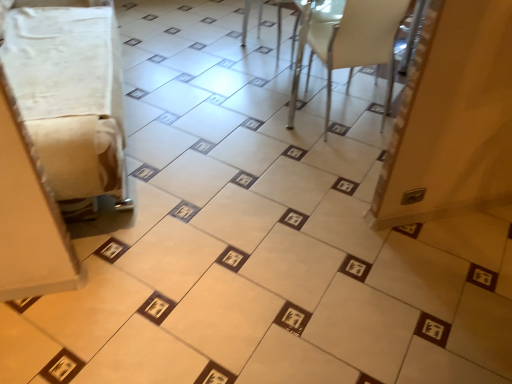
The height and width of the screenshot is (384, 512). What are the coordinates of `white fabric at left, which is the first furniture from left to right` in the screenshot? It's located at (69, 95).

This screenshot has width=512, height=384. Describe the element at coordinates (69, 95) in the screenshot. I see `white fabric at left, which is the first furniture from left to right` at that location.

Measure the distance between white fabric at left, acting as the second furniture starting from the right, and camera.

white fabric at left, acting as the second furniture starting from the right, is 4.86 feet away from camera.

What do you see at coordinates (348, 43) in the screenshot? I see `white plastic chair at upper right, which ranks as the 2th furniture in left-to-right order` at bounding box center [348, 43].

This screenshot has height=384, width=512. I want to click on white plastic chair at upper right, which ranks as the 2th furniture in left-to-right order, so click(348, 43).

Locate an element on the screen. white fabric at left, which is the first furniture from left to right is located at coordinates (69, 95).

Between white fabric at left, acting as the second furniture starting from the right, and white plastic chair at upper right, which ranks as the 2th furniture in left-to-right order, which one appears on the left side from the viewer's perspective?

white fabric at left, acting as the second furniture starting from the right, is more to the left.

Is white fabric at left, acting as the second furniture starting from the right, closer to camera compared to white plastic chair at upper right, which is counted as the 1th furniture, starting from the right?

Yes, it is in front of white plastic chair at upper right, which is counted as the 1th furniture, starting from the right.

Which is further, (54, 62) or (338, 39)?

Positioned behind is point (54, 62).

From the image's perspective, which is above, white fabric at left, which is the first furniture from left to right, or white plastic chair at upper right, which ranks as the 2th furniture in left-to-right order?

white plastic chair at upper right, which ranks as the 2th furniture in left-to-right order, is shown above in the image.

From a real-world perspective, which object stands above the other?

In real-world perspective, white fabric at left, which is the first furniture from left to right, is above.

Considering the sizes of objects white fabric at left, acting as the second furniture starting from the right, and white plastic chair at upper right, which ranks as the 2th furniture in left-to-right order, in the image provided, who is thinner, white fabric at left, acting as the second furniture starting from the right, or white plastic chair at upper right, which ranks as the 2th furniture in left-to-right order,?

Thinner between the two is white plastic chair at upper right, which ranks as the 2th furniture in left-to-right order.

Can you confirm if white fabric at left, which is the first furniture from left to right, is taller than white plastic chair at upper right, which ranks as the 2th furniture in left-to-right order?

No, white fabric at left, which is the first furniture from left to right, is not taller than white plastic chair at upper right, which ranks as the 2th furniture in left-to-right order.

Can you confirm if white fabric at left, acting as the second furniture starting from the right, is smaller than white plastic chair at upper right, which is counted as the 1th furniture, starting from the right?

No.

Would you say white fabric at left, which is the first furniture from left to right, is inside or outside white plastic chair at upper right, which ranks as the 2th furniture in left-to-right order?

white fabric at left, which is the first furniture from left to right, cannot be found inside white plastic chair at upper right, which ranks as the 2th furniture in left-to-right order.

Is white fabric at left, which is the first furniture from left to right, placed right next to white plastic chair at upper right, which ranks as the 2th furniture in left-to-right order?

No, white fabric at left, which is the first furniture from left to right, is not next to white plastic chair at upper right, which ranks as the 2th furniture in left-to-right order.

Is white fabric at left, acting as the second furniture starting from the right, positioned with its back to white plastic chair at upper right, which ranks as the 2th furniture in left-to-right order?

No, white fabric at left, acting as the second furniture starting from the right,'s orientation is not away from white plastic chair at upper right, which ranks as the 2th furniture in left-to-right order.

Measure the distance from white fabric at left, which is the first furniture from left to right, to white plastic chair at upper right, which is counted as the 1th furniture, starting from the right.

white fabric at left, which is the first furniture from left to right, is 1.23 meters away from white plastic chair at upper right, which is counted as the 1th furniture, starting from the right.

The width and height of the screenshot is (512, 384). What are the coordinates of `furniture positioned vertically above the white plastic chair at upper right, which is counted as the 1th furniture, starting from the right (from a real-world perspective)` in the screenshot? It's located at (69, 95).

Considering the relative positions of white plastic chair at upper right, which is counted as the 1th furniture, starting from the right, and white fabric at left, acting as the second furniture starting from the right, in the image provided, is white plastic chair at upper right, which is counted as the 1th furniture, starting from the right, to the right of white fabric at left, acting as the second furniture starting from the right, from the viewer's perspective?

Yes.

Which object is further away from the camera taking this photo, white plastic chair at upper right, which ranks as the 2th furniture in left-to-right order, or white fabric at left, which is the first furniture from left to right?

white plastic chair at upper right, which ranks as the 2th furniture in left-to-right order.

Which point is more distant from viewer, [316,38] or [82,89]?

The point [316,38] is farther from the camera.

From the image's perspective, is white plastic chair at upper right, which ranks as the 2th furniture in left-to-right order, located above or below white fabric at left, acting as the second furniture starting from the right?

Based on their image positions, white plastic chair at upper right, which ranks as the 2th furniture in left-to-right order, is located above white fabric at left, acting as the second furniture starting from the right.

From a real-world perspective, does white plastic chair at upper right, which ranks as the 2th furniture in left-to-right order, stand above white fabric at left, which is the first furniture from left to right?

Actually, white plastic chair at upper right, which ranks as the 2th furniture in left-to-right order, is physically below white fabric at left, which is the first furniture from left to right, in the real world.

Considering the relative sizes of white plastic chair at upper right, which is counted as the 1th furniture, starting from the right, and white fabric at left, which is the first furniture from left to right, in the image provided, is white plastic chair at upper right, which is counted as the 1th furniture, starting from the right, wider than white fabric at left, which is the first furniture from left to right,?

Incorrect, the width of white plastic chair at upper right, which is counted as the 1th furniture, starting from the right, does not surpass that of white fabric at left, which is the first furniture from left to right.

Between white plastic chair at upper right, which is counted as the 1th furniture, starting from the right, and white fabric at left, acting as the second furniture starting from the right, which one has less height?

Standing shorter between the two is white fabric at left, acting as the second furniture starting from the right.

Considering the relative sizes of white plastic chair at upper right, which is counted as the 1th furniture, starting from the right, and white fabric at left, which is the first furniture from left to right, in the image provided, is white plastic chair at upper right, which is counted as the 1th furniture, starting from the right, bigger than white fabric at left, which is the first furniture from left to right,?

Actually, white plastic chair at upper right, which is counted as the 1th furniture, starting from the right, might be smaller than white fabric at left, which is the first furniture from left to right.

Could white fabric at left, which is the first furniture from left to right, be considered to be inside white plastic chair at upper right, which is counted as the 1th furniture, starting from the right?

No, white fabric at left, which is the first furniture from left to right, is not inside white plastic chair at upper right, which is counted as the 1th furniture, starting from the right.

Is white plastic chair at upper right, which ranks as the 2th furniture in left-to-right order, far from white fabric at left, which is the first furniture from left to right?

Absolutely, white plastic chair at upper right, which ranks as the 2th furniture in left-to-right order, is distant from white fabric at left, which is the first furniture from left to right.

Could you tell me if white plastic chair at upper right, which is counted as the 1th furniture, starting from the right, is turned towards white fabric at left, which is the first furniture from left to right?

No, white plastic chair at upper right, which is counted as the 1th furniture, starting from the right, is not facing towards white fabric at left, which is the first furniture from left to right.

How distant is white plastic chair at upper right, which is counted as the 1th furniture, starting from the right, from white fabric at left, acting as the second furniture starting from the right?

white plastic chair at upper right, which is counted as the 1th furniture, starting from the right, and white fabric at left, acting as the second furniture starting from the right, are 4.05 feet apart from each other.

Find the location of a particular element. This screenshot has height=384, width=512. furniture lying above the white fabric at left, acting as the second furniture starting from the right (from the image's perspective) is located at coordinates (348, 43).

Locate an element on the screen. furniture that appears on the left of white plastic chair at upper right, which is counted as the 1th furniture, starting from the right is located at coordinates (69, 95).

Find the location of a particular element. Image resolution: width=512 pixels, height=384 pixels. furniture on the right of the white fabric at left, acting as the second furniture starting from the right is located at coordinates (348, 43).